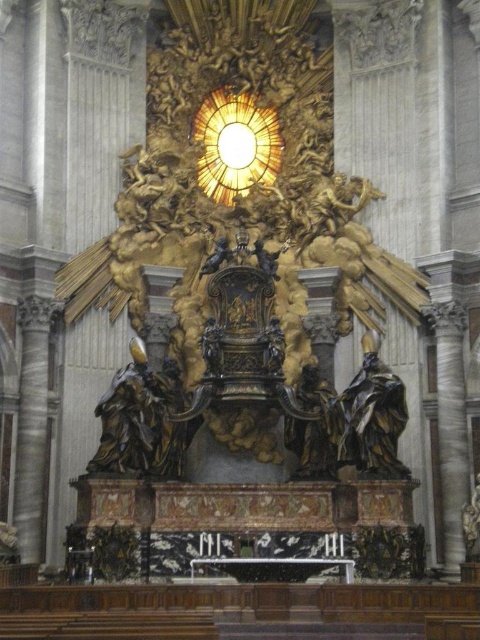
Which is below, golden textured clock at upper center or bronze statue at right?

bronze statue at right is lower down.

Does golden textured clock at upper center appear over bronze statue at right?

Correct, golden textured clock at upper center is located above bronze statue at right.

Describe the element at coordinates (236, 145) in the screenshot. I see `golden textured clock at upper center` at that location.

The image size is (480, 640). I want to click on golden textured clock at upper center, so click(x=236, y=145).